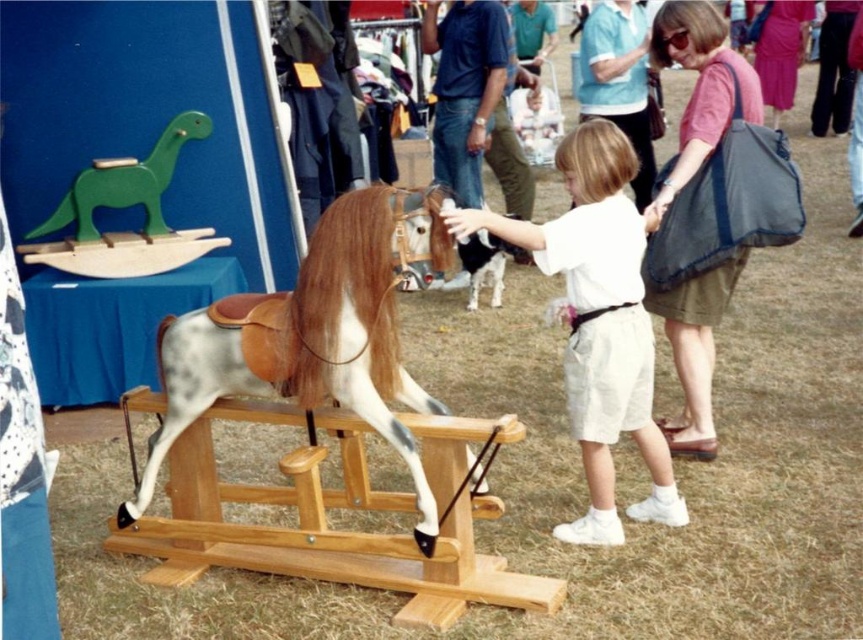
Consider the image. You are a parent standing next to a speckled wood horse at center and a white cotton shirt at center. Your child is playing with the horse. You want to hand them a juice box. Can you reach them without moving from your current position?

The speckled wood horse at center and white cotton shirt at center are 70.19 centimeters apart from each other. Since the distance is less than an average adult arm length of about 70 cm, you can likely reach the child without moving.

You are standing in the fairground and see two points marked in the scene. Which point is closer to you, point (605, 400) or point (143, 198)?

Point (605, 400) is closer to the viewer than point (143, 198).

You are a photographer trying to capture a clear image of the speckled wood horse at center and the white cotton shirt at center. From your current position, which object is closer to you?

The speckled wood horse at center is closer to you because it is in front of the white cotton shirt at center.